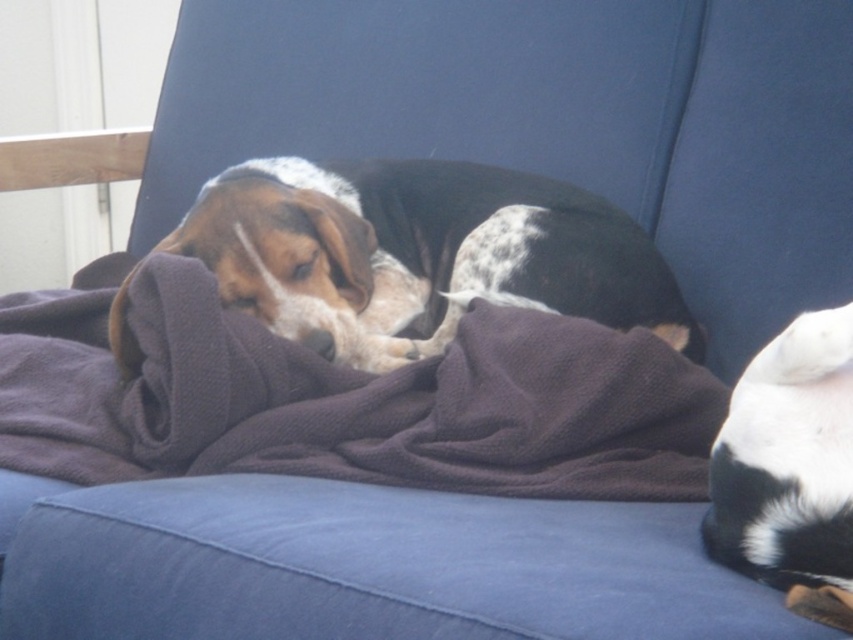
Question: Is brown cotton blanket at center bigger than white soft fur at lower right?

Choices:
 (A) no
 (B) yes

Answer: (B)

Question: Is brown cotton blanket at center in front of white soft fur at lower right?

Choices:
 (A) yes
 (B) no

Answer: (B)

Question: Which object is positioned farthest from the brown cotton blanket at center?

Choices:
 (A) white soft fur at lower right
 (B) brown and white fur dog at center

Answer: (A)

Question: Which object appears closest to the camera in this image?

Choices:
 (A) brown and white fur dog at center
 (B) brown cotton blanket at center

Answer: (B)

Question: Which object is positioned closest to the brown cotton blanket at center?

Choices:
 (A) brown and white fur dog at center
 (B) white soft fur at lower right

Answer: (A)

Question: Is brown cotton blanket at center to the right of white soft fur at lower right from the viewer's perspective?

Choices:
 (A) no
 (B) yes

Answer: (A)